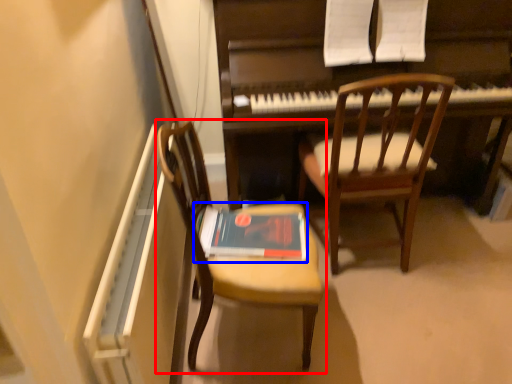
Question: Among these objects, which one is nearest to the camera, chair (highlighted by a red box) or paperback book (highlighted by a blue box)?

Choices:
 (A) chair
 (B) paperback book

Answer: (A)